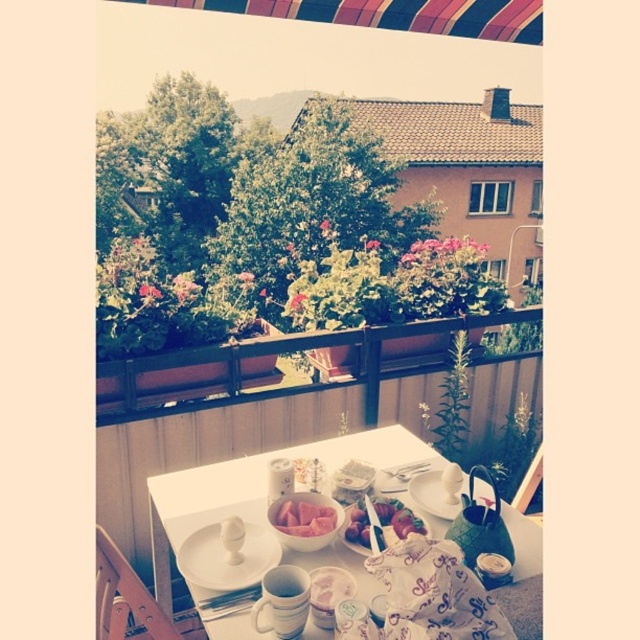
You are a guest at this balcony and want to place a napkin on the white glossy plate at center. However, you need to reach it from the white glossy table at center. Is the plate accessible from the table?

The white glossy table at center is in front of the white glossy plate at center, so the plate is behind the table and not directly accessible from it. You would need to move around the table to reach the plate.